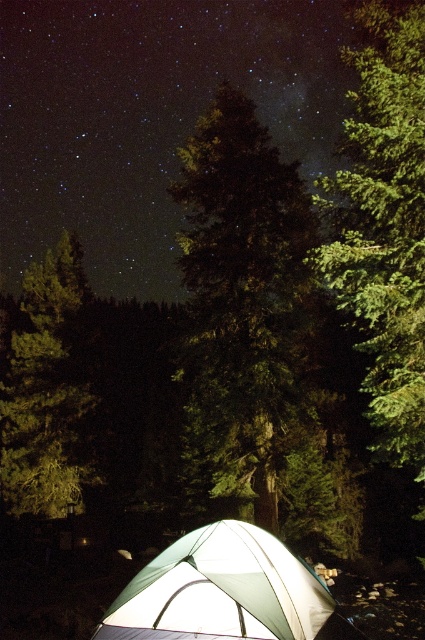
Which is below, white fabric tent at lower center or green textured tree at left?

white fabric tent at lower center is lower down.

Can you confirm if white fabric tent at lower center is shorter than green textured tree at left?

Yes.

Between point (308, 612) and point (48, 259), which one is positioned behind?

The point (48, 259) is behind.

Locate an element on the screen. white fabric tent at lower center is located at coordinates (223, 592).

The width and height of the screenshot is (425, 640). What do you see at coordinates (240, 301) in the screenshot?
I see `green textured tree at center` at bounding box center [240, 301].

From the picture: Is green textured tree at center to the left of green textured pine tree at upper right from the viewer's perspective?

Yes, green textured tree at center is to the left of green textured pine tree at upper right.

The width and height of the screenshot is (425, 640). Describe the element at coordinates (240, 301) in the screenshot. I see `green textured tree at center` at that location.

Locate an element on the screen. This screenshot has height=640, width=425. green textured tree at center is located at coordinates (240, 301).

What do you see at coordinates (385, 224) in the screenshot? I see `green textured pine tree at upper right` at bounding box center [385, 224].

Who is shorter, green textured pine tree at upper right or white fabric tent at lower center?

Standing shorter between the two is white fabric tent at lower center.

Is point (360, 90) closer to viewer compared to point (243, 580)?

No, it is not.

This screenshot has height=640, width=425. Identify the location of green textured pine tree at upper right. (385, 224).